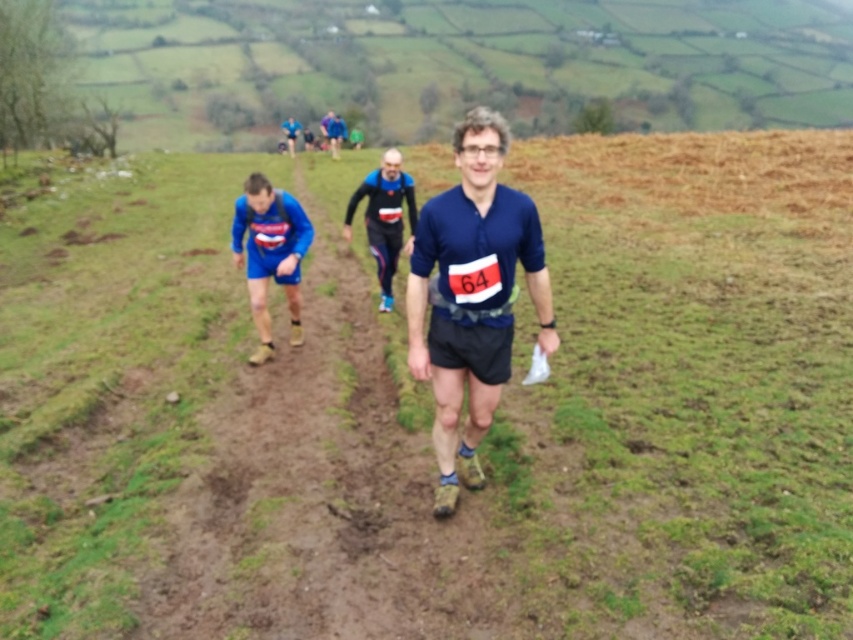
You are a photographer standing at the starting line of the trail running event. You want to take a photo of the matte blue shorts at center and the blue fabric shirt at upper center. Based on their positions, which object should you adjust your camera focus to first to ensure both are in frame?

The blue fabric shirt at upper center should be focused on first since the matte blue shorts at center is positioned to its right, allowing you to adjust the camera to include both by panning slightly to the right.

You are a photographer positioned at the origin point of the coordinate system. You want to capture a photo of the matte blue shorts at center. What are the coordinates where you should aim your camera?

The coordinates to aim your camera are at point (270, 253).

You are a runner preparing for a race on the brown dirt track at center. You notice the blue fabric running suit at center worn by another runner. Which object occupies more space in the image?

The brown dirt track at center has a larger size compared to the blue fabric running suit at center, so the brown dirt track at center occupies more space in the image.